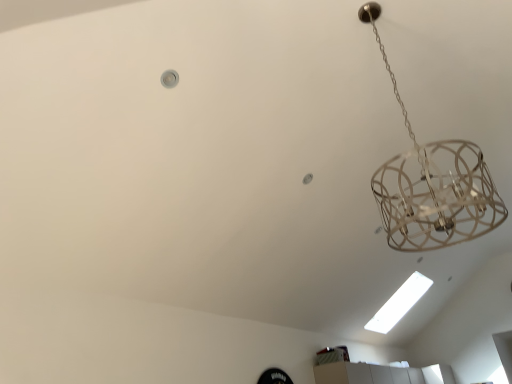
Question: Can you confirm if white fluorescent light at upper center is taller than metallic wire chandelier at upper right?

Choices:
 (A) no
 (B) yes

Answer: (B)

Question: Is white fluorescent light at upper center outside of metallic wire chandelier at upper right?

Choices:
 (A) yes
 (B) no

Answer: (A)

Question: Is white fluorescent light at upper center in contact with metallic wire chandelier at upper right?

Choices:
 (A) no
 (B) yes

Answer: (A)

Question: From the image's perspective, is white fluorescent light at upper center below metallic wire chandelier at upper right?

Choices:
 (A) yes
 (B) no

Answer: (A)

Question: Is metallic wire chandelier at upper right located within white fluorescent light at upper center?

Choices:
 (A) no
 (B) yes

Answer: (A)

Question: Can you confirm if white fluorescent light at upper center is bigger than metallic wire chandelier at upper right?

Choices:
 (A) no
 (B) yes

Answer: (B)

Question: Can you confirm if metallic wire chandelier at upper right is positioned to the right of white fluorescent light at upper center?

Choices:
 (A) yes
 (B) no

Answer: (A)

Question: Is metallic wire chandelier at upper right positioned with its back to white fluorescent light at upper center?

Choices:
 (A) no
 (B) yes

Answer: (A)

Question: Does metallic wire chandelier at upper right appear on the left side of white fluorescent light at upper center?

Choices:
 (A) no
 (B) yes

Answer: (A)

Question: From the image's perspective, would you say metallic wire chandelier at upper right is positioned over white fluorescent light at upper center?

Choices:
 (A) no
 (B) yes

Answer: (B)

Question: Considering the relative sizes of metallic wire chandelier at upper right and white fluorescent light at upper center in the image provided, is metallic wire chandelier at upper right smaller than white fluorescent light at upper center?

Choices:
 (A) no
 (B) yes

Answer: (B)

Question: Can you confirm if metallic wire chandelier at upper right is thinner than white fluorescent light at upper center?

Choices:
 (A) no
 (B) yes

Answer: (A)

Question: Visually, is metallic wire chandelier at upper right positioned to the left or to the right of white fluorescent light at upper center?

Choices:
 (A) left
 (B) right

Answer: (B)